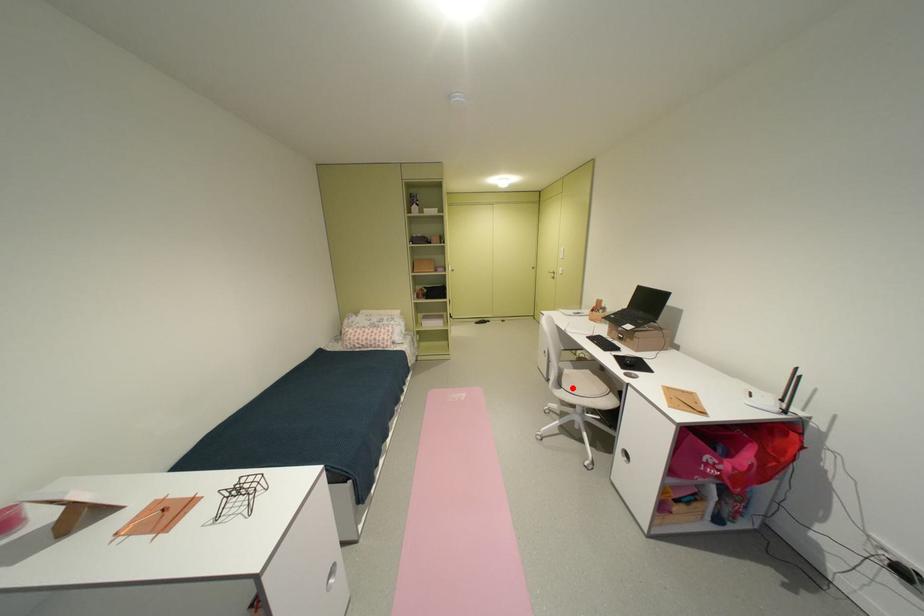
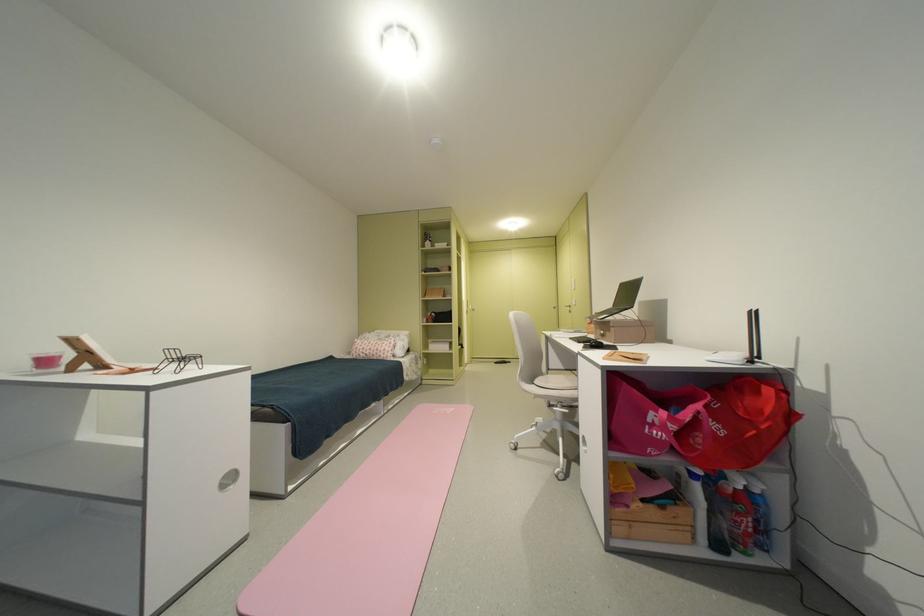
Question: A red point is marked in image1. In image2, is the corresponding 3D point closer to the camera or farther? Reply with the corresponding letter.

Choices:
 (A) The corresponding 3D point is closer.
 (B) The corresponding 3D point is farther.

Answer: (B)